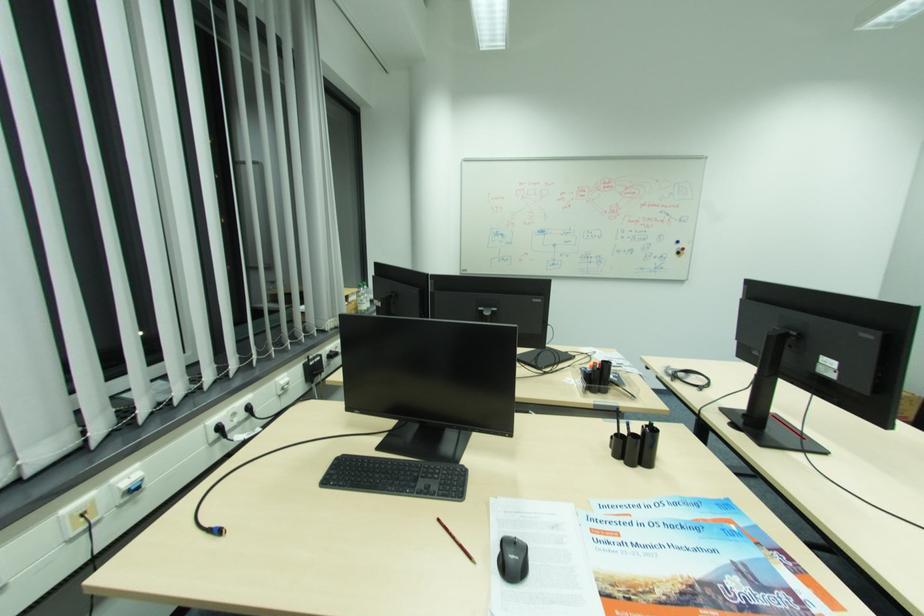
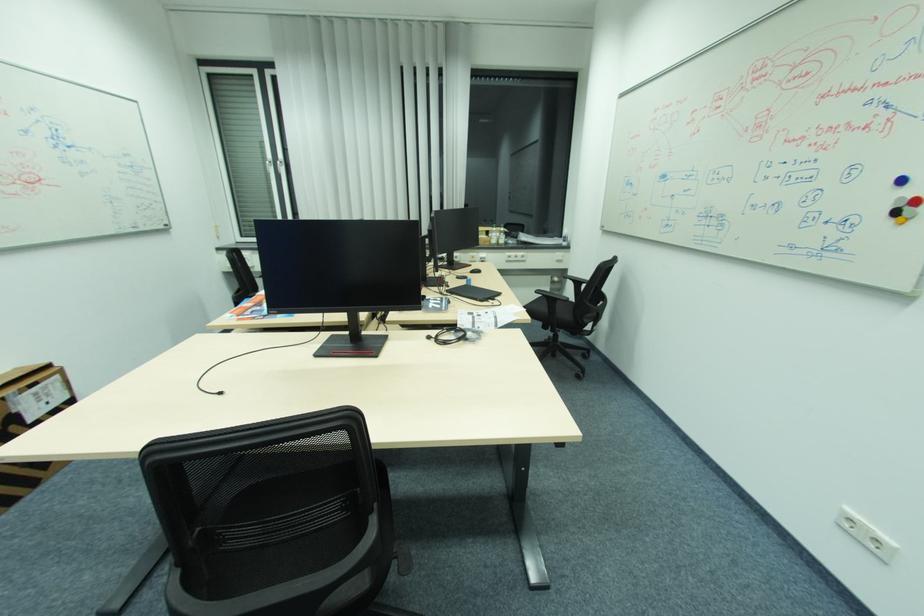
Find the pixel in the second image that matches pixel 684 241 in the first image.

(908, 180)